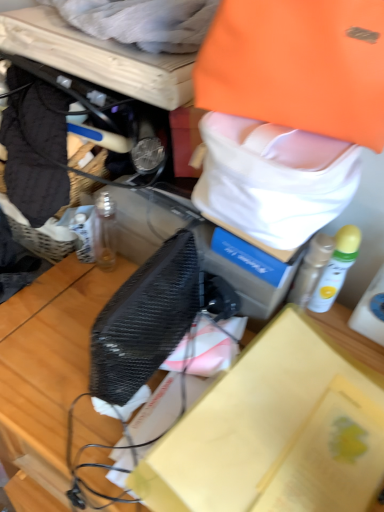
You are a GUI agent. You are given a task and a screenshot of the screen. Output one action in this format:
    pyautogui.click(x=<x>, y=<y>)
    Task: Click on the free space in front of white matte spray can at right, the 2th bottle when ordered from left to right
    
    Given the screenshot: What is the action you would take?
    pyautogui.click(x=344, y=400)